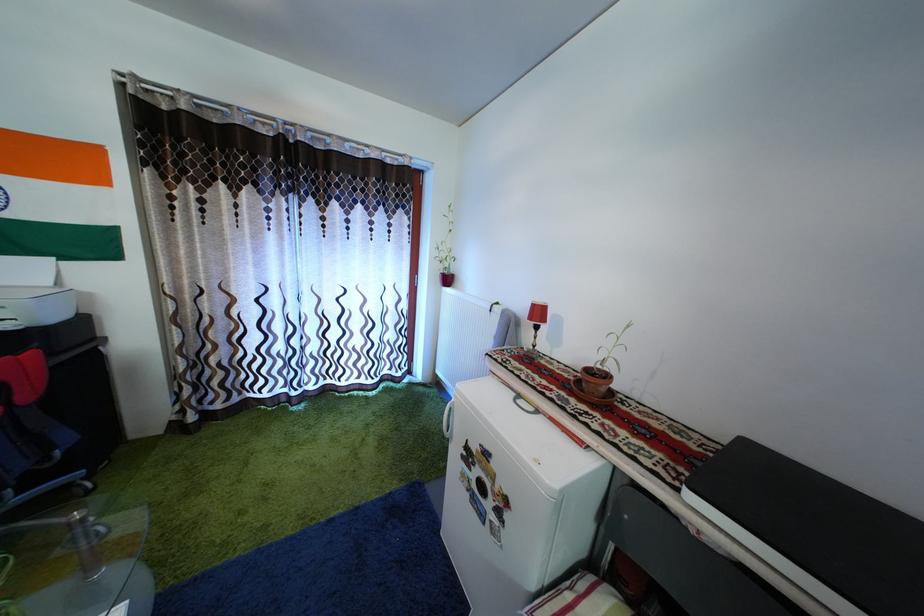
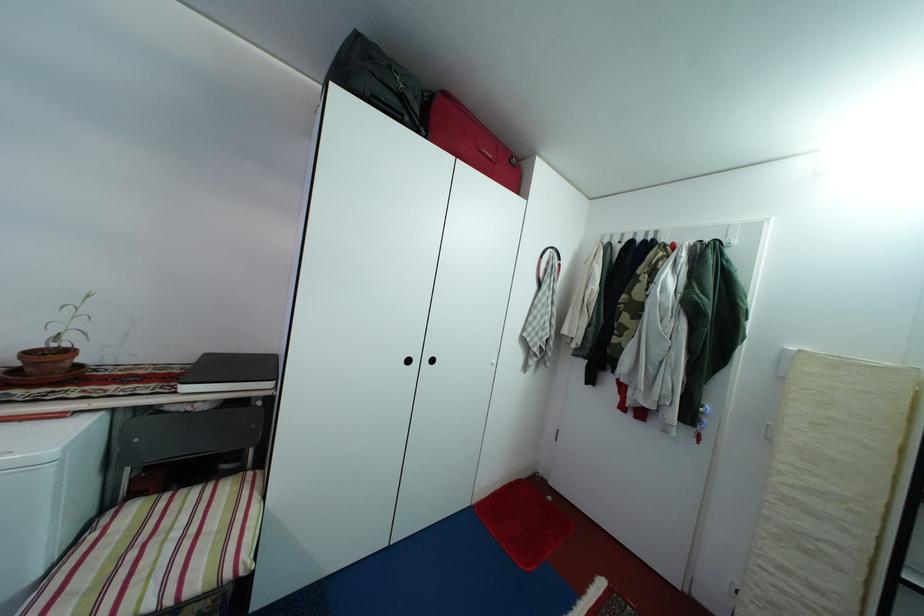
The point at [594,378] is marked in the first image. Where is the corresponding point in the second image?

(38, 361)